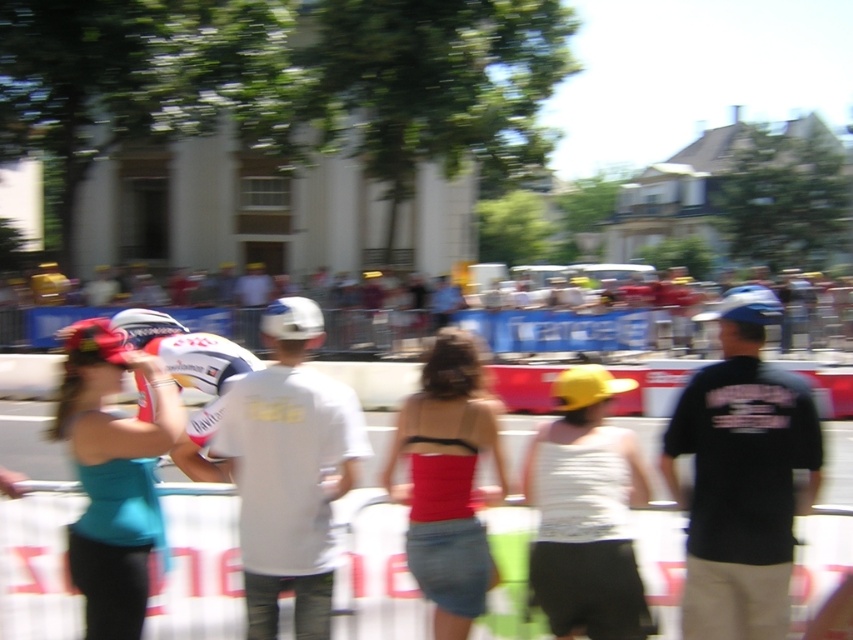
You are a photographer standing at the starting line of the cycling race. You want to take a photo that includes both the cyclist in the foreground and the large classical building in the background. Which of the two points, point (706, 609) or point (677, 300), is closer to you and should be prioritized in your composition to ensure both elements are in focus?

Point (706, 609) is closer to the viewer than point (677, 300). To ensure both the cyclist and the building are in focus, prioritize composing the shot so that the closer point (706, 609) is within your depth of field range.

You are a photographer positioned at the center of the scene. You want to take a photo that includes both the white glossy helmet at center and the white matte bicycle helmet at center. Given that your camera has a focal length of 50mm and a sensor size of 24mm x 36mm, what is the minimum distance you need to stand from the helmets to ensure both fit within the frame?

The distance between the white glossy helmet at center and the white matte bicycle helmet at center is 1.36 meters. Using the formula for field of view, the minimum distance required would be calculated as follows...